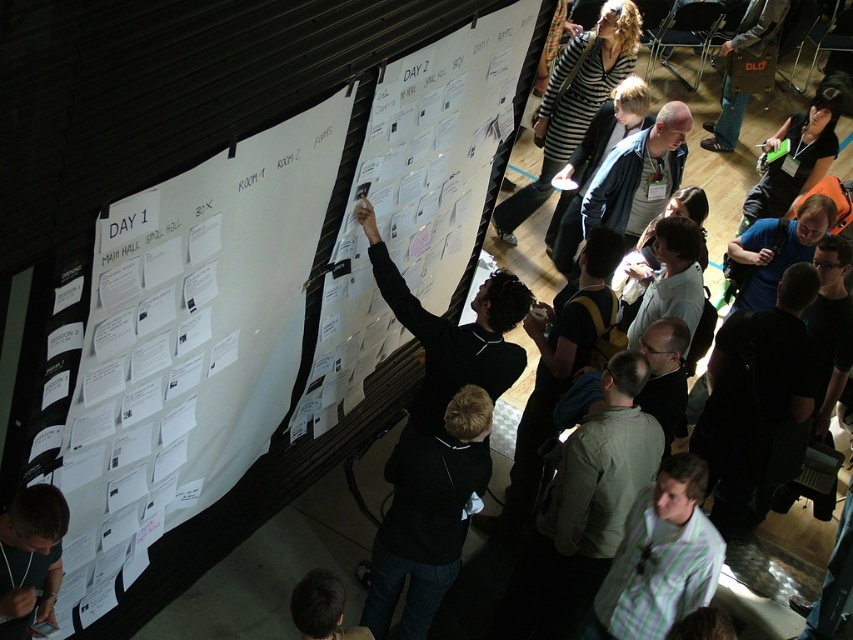
Which is behind, point (763, 173) or point (746, 16)?

Point (746, 16)

I want to click on orange fabric shirt at upper right, so click(x=793, y=160).

Which is more to the left, striped fabric shirt at upper center or dark brown hair at lower center?

Positioned to the left is dark brown hair at lower center.

Is striped fabric shirt at upper center shorter than dark brown hair at lower center?

In fact, striped fabric shirt at upper center may be taller than dark brown hair at lower center.

At what (x,y) coordinates should I click in order to perform the action: click on striped fabric shirt at upper center. Please return your answer as a coordinate pair (x, y). The width and height of the screenshot is (853, 640). Looking at the image, I should click on (573, 104).

Is point (747, 10) positioned before point (318, 630)?

No, (747, 10) is further to viewer.

From the picture: Can you confirm if leather bag at center is positioned to the right of dark brown hair at lower center?

Yes, leather bag at center is to the right of dark brown hair at lower center.

This screenshot has height=640, width=853. I want to click on leather bag at center, so click(x=730, y=72).